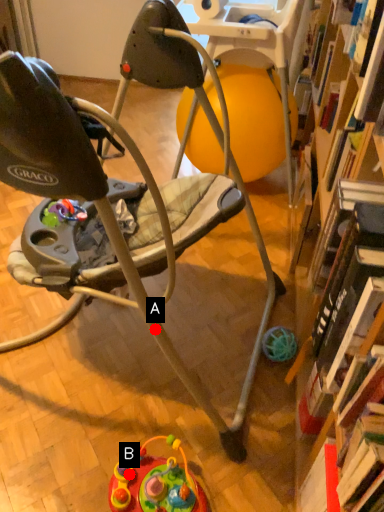
Question: Two points are circled on the image, labeled by A and B beside each circle. Which of the following is the farthest from the observer?

Choices:
 (A) A is further
 (B) B is further

Answer: (B)